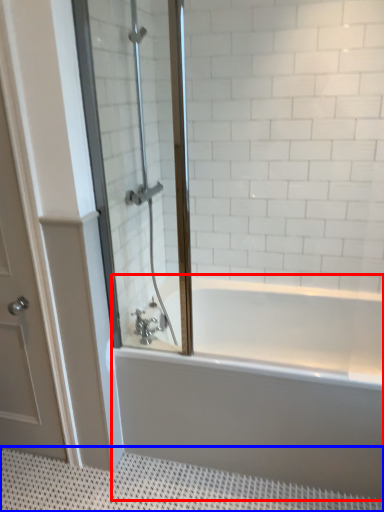
Question: Which point is further to the camera, bathtub (highlighted by a red box) or bath mat (highlighted by a blue box)?

Choices:
 (A) bathtub
 (B) bath mat

Answer: (A)